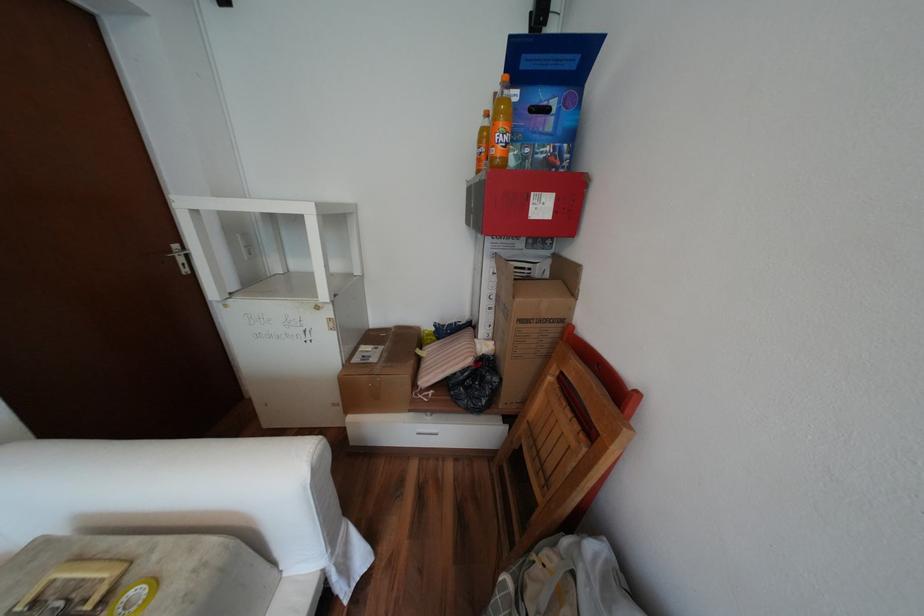
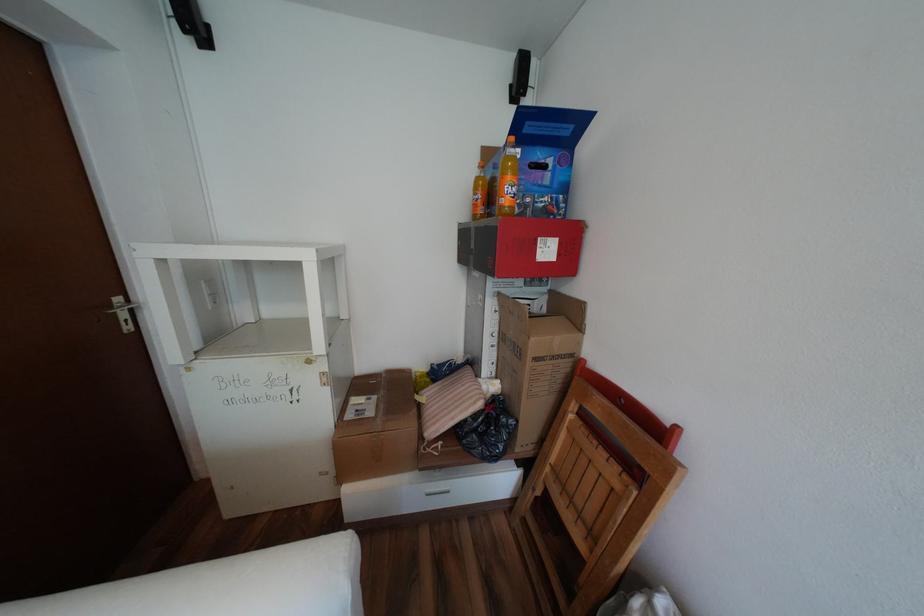
The point at (532, 57) is marked in the first image. Where is the corresponding point in the second image?

(537, 123)